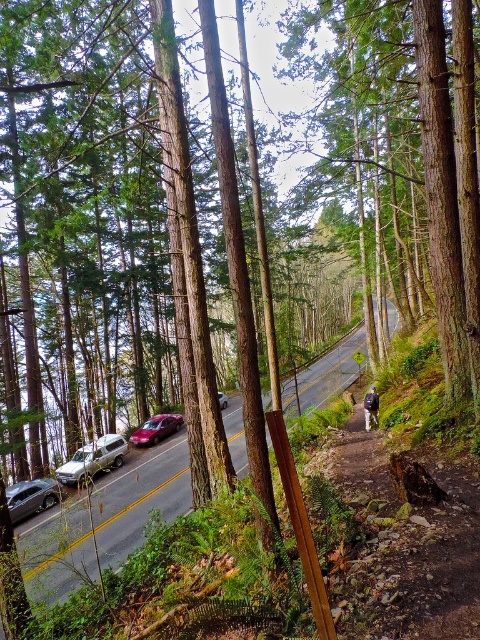
Question: Based on their relative distances, which object is nearer to the metallic red car at center?

Choices:
 (A) dark blue backpack at lower right
 (B) metallic red sedan at center-left
 (C) shiny silver sedan at lower left
 (D) silver metallic suv at center-left

Answer: (B)

Question: Is silver metallic suv at center-left positioned before dark blue backpack at lower right?

Choices:
 (A) yes
 (B) no

Answer: (B)

Question: Which of the following is the closest to the observer?

Choices:
 (A) dark blue backpack at lower right
 (B) metallic red sedan at center-left

Answer: (A)

Question: Can you confirm if metallic red sedan at center-left is wider than dark blue backpack at lower right?

Choices:
 (A) yes
 (B) no

Answer: (A)

Question: Can you confirm if dark blue backpack at lower right is wider than metallic red car at center?

Choices:
 (A) no
 (B) yes

Answer: (A)

Question: Which object is closer to the camera taking this photo?

Choices:
 (A) silver metallic suv at center-left
 (B) shiny silver sedan at lower left

Answer: (B)